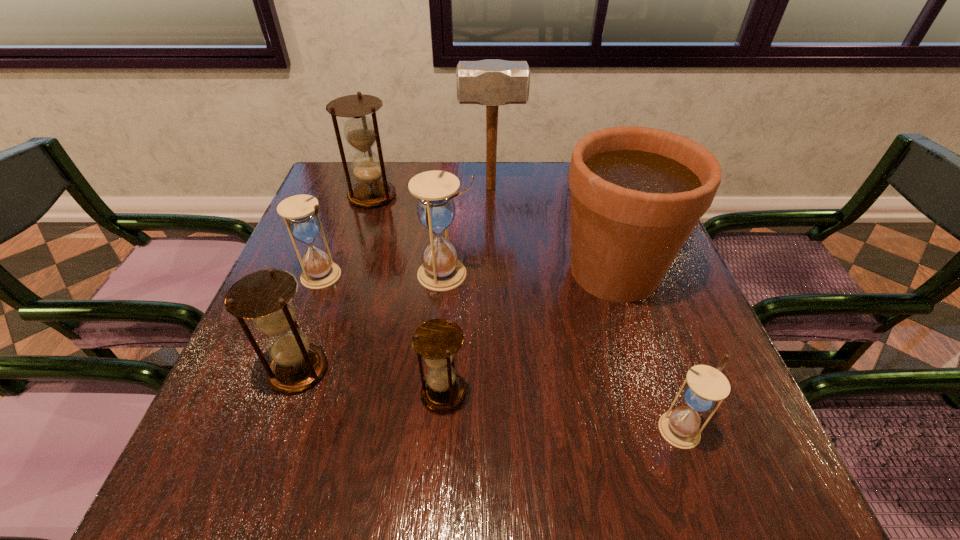
Where is `free spot at the right edge of the desktop`? The image size is (960, 540). free spot at the right edge of the desktop is located at coordinates (653, 343).

This screenshot has height=540, width=960. In order to click on vacant space at the near left corner in this screenshot , I will do `click(218, 452)`.

You are a GUI agent. You are given a task and a screenshot of the screen. Output one action in this format:
    pyautogui.click(x=<x>, y=<y>)
    Task: Click on the free space between the second smallest brown hourglass and the smallest brown hourglass
    This screenshot has height=540, width=960.
    Given the screenshot: What is the action you would take?
    pyautogui.click(x=372, y=382)

Find the location of `free space between the biggest white hourglass and the biggest brown hourglass`. free space between the biggest white hourglass and the biggest brown hourglass is located at coordinates (409, 235).

Where is `free spot between the biggest white hourglass and the flowerpot`? free spot between the biggest white hourglass and the flowerpot is located at coordinates (530, 272).

This screenshot has width=960, height=540. I want to click on vacant area that lies between the rightmost brown hourglass and the farthest hourglass, so click(408, 295).

Where is `free spot between the flowerpot and the smallest brown hourglass`? free spot between the flowerpot and the smallest brown hourglass is located at coordinates (529, 332).

This screenshot has height=540, width=960. Find the location of `free space between the smallest brown hourglass and the flowerpot`. free space between the smallest brown hourglass and the flowerpot is located at coordinates (529, 332).

The width and height of the screenshot is (960, 540). I want to click on vacant area that lies between the rightmost brown hourglass and the flowerpot, so click(x=529, y=332).

I want to click on blank region between the second smallest brown hourglass and the farthest hourglass, so [335, 283].